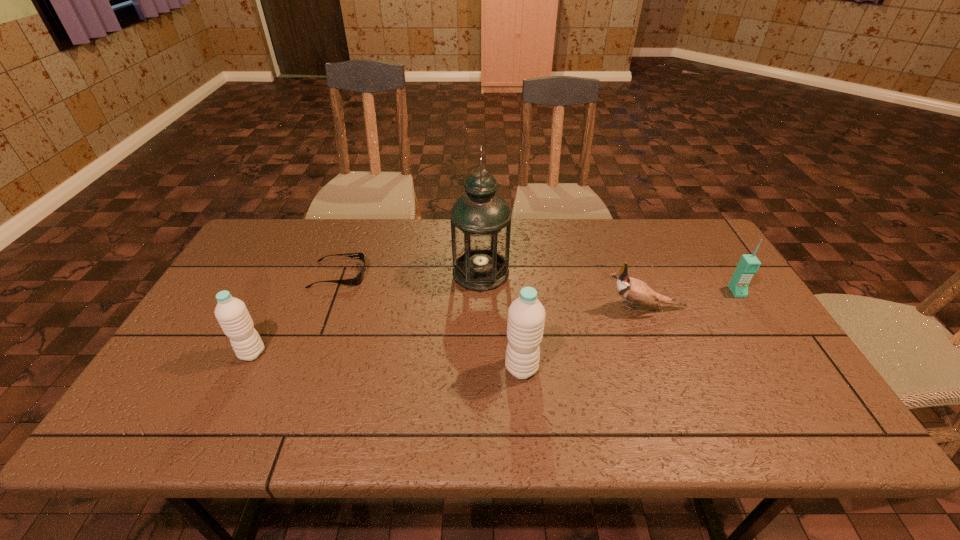
The image size is (960, 540). I want to click on free area in between the third nearest object and the sunglasses, so click(492, 292).

At what (x,y) coordinates should I click in order to perform the action: click on unoccupied area between the third nearest object and the shortest object. Please return your answer as a coordinate pair (x, y). The image size is (960, 540). Looking at the image, I should click on (492, 292).

Find the location of `unoccupied area between the fourth farthest object and the tallest object`. unoccupied area between the fourth farthest object and the tallest object is located at coordinates (563, 291).

I want to click on vacant space that's between the cellular telephone and the shortest object, so click(x=538, y=284).

The height and width of the screenshot is (540, 960). Identify the location of vacant space that is in between the second object from left to right and the cellular telephone. (538, 284).

I want to click on vacant area that lies between the leftmost object and the taller water bottle, so click(x=387, y=361).

Where is `free space between the left water bottle and the tallest object`? This screenshot has height=540, width=960. free space between the left water bottle and the tallest object is located at coordinates (367, 313).

Where is `free space that is in between the rightmost object and the shortest object`? The height and width of the screenshot is (540, 960). free space that is in between the rightmost object and the shortest object is located at coordinates (538, 284).

Find the location of a particular element. This screenshot has height=540, width=960. vacant space in between the right water bottle and the second object from right to left is located at coordinates (583, 338).

The image size is (960, 540). I want to click on free point between the oil lamp and the left water bottle, so click(x=367, y=313).